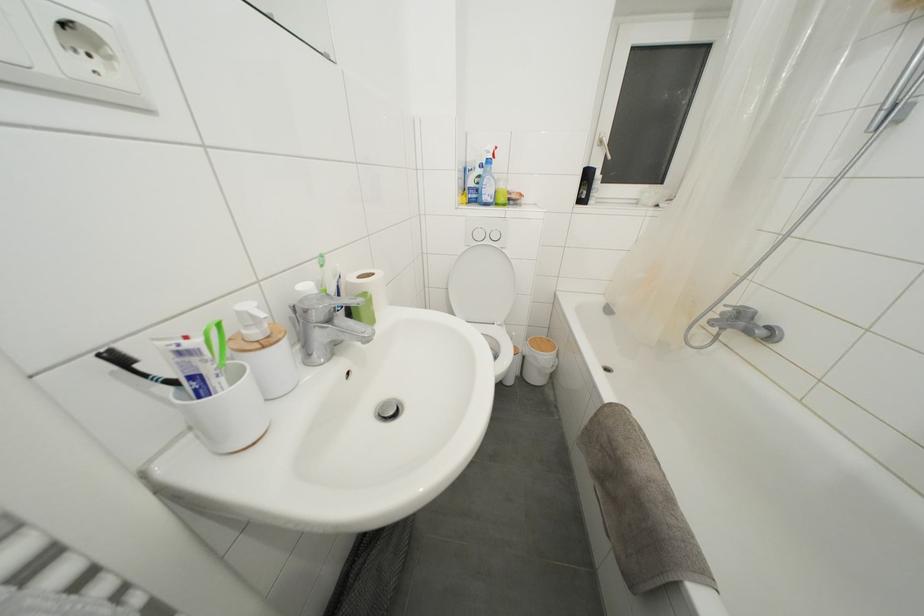
Where is `white dispenser pump`? white dispenser pump is located at coordinates (251, 321).